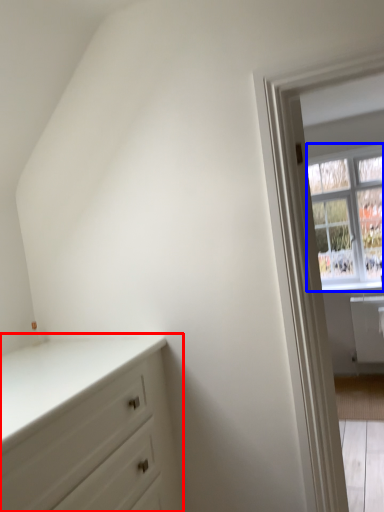
Question: Which object is further to the camera taking this photo, chest of drawers (highlighted by a red box) or window (highlighted by a blue box)?

Choices:
 (A) chest of drawers
 (B) window

Answer: (B)